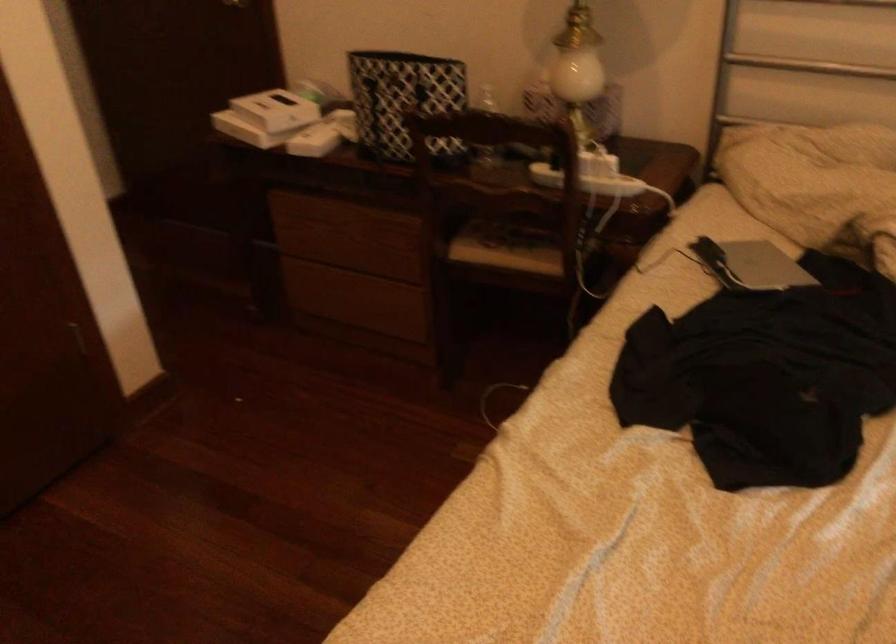
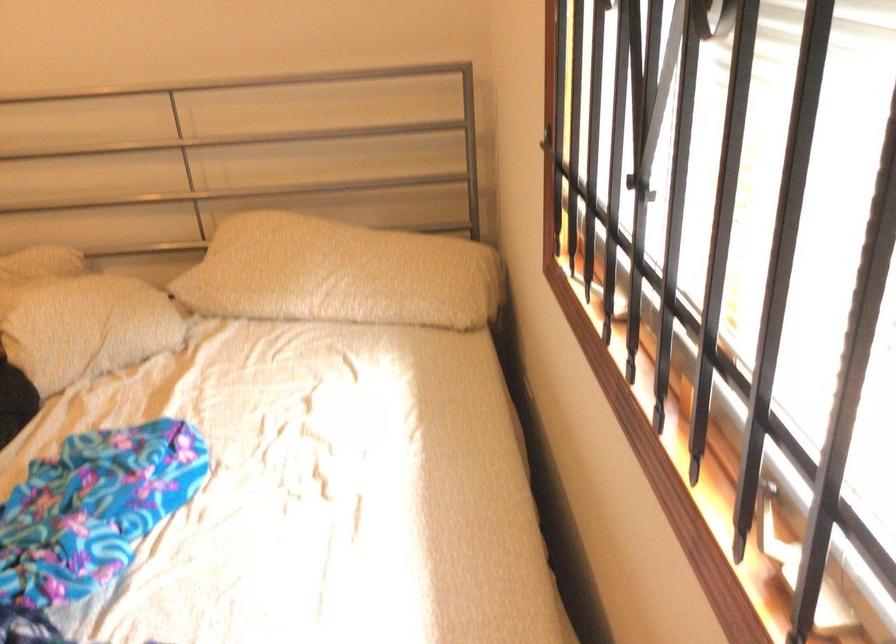
Question: How did the camera likely rotate?

Choices:
 (A) Left
 (B) Right
 (C) Up
 (D) Down

Answer: (B)